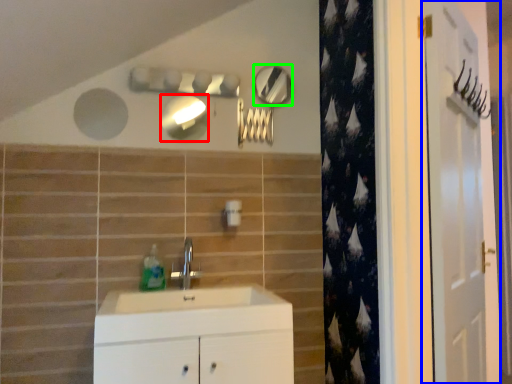
Question: Based on their relative distances, which object is nearer to mirror (highlighted by a red box)? Choose from door (highlighted by a blue box) and mirror (highlighted by a green box).

Choices:
 (A) door
 (B) mirror

Answer: (B)